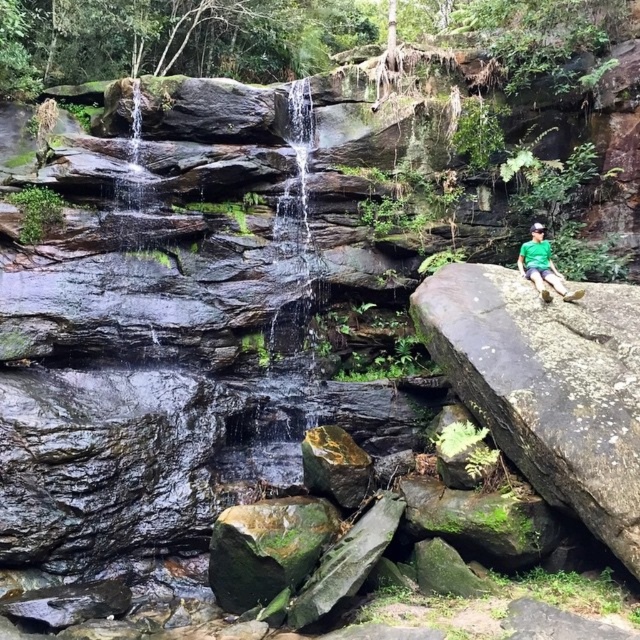
How far apart are green mossy rock at right and green fabric shirt at right?

A distance of 27.41 inches exists between green mossy rock at right and green fabric shirt at right.

Does green mossy rock at right lie behind green fabric shirt at right?

No, it is in front of green fabric shirt at right.

The height and width of the screenshot is (640, 640). Find the location of `green mossy rock at right`. green mossy rock at right is located at coordinates (547, 387).